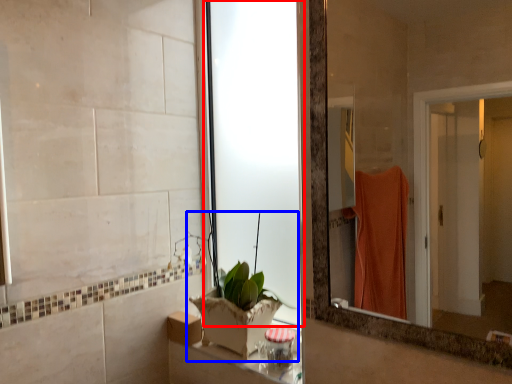
Question: Among these objects, which one is farthest to the camera, glass door (highlighted by a red box) or houseplant (highlighted by a blue box)?

Choices:
 (A) glass door
 (B) houseplant

Answer: (A)